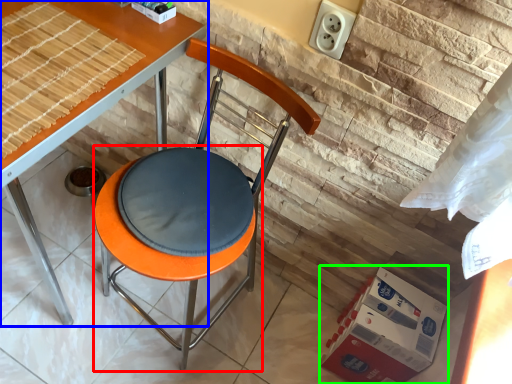
Question: Estimate the real-world distances between objects in this image. Which object is farther from bar stool (highlighted by a red box), table (highlighted by a blue box) or cardboard box (highlighted by a green box)?

Choices:
 (A) table
 (B) cardboard box

Answer: (A)